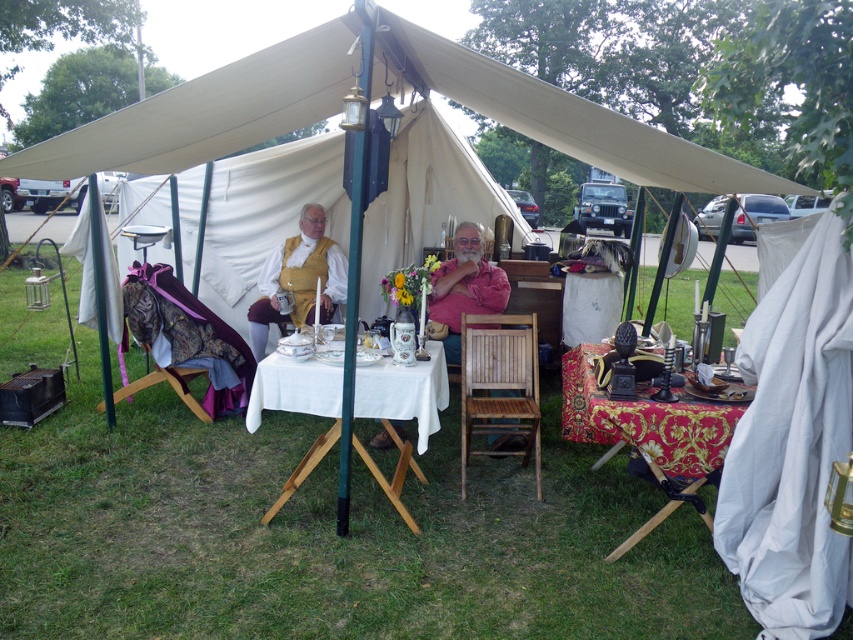
Is red damask tablecloth at lower right smaller than matte yellow vest at center?

Incorrect, red damask tablecloth at lower right is not smaller in size than matte yellow vest at center.

I want to click on red damask tablecloth at lower right, so click(645, 420).

You are a GUI agent. You are given a task and a screenshot of the screen. Output one action in this format:
    pyautogui.click(x=<x>, y=<y>)
    Task: Click on the red damask tablecloth at lower right
    Image resolution: width=853 pixels, height=640 pixels.
    Given the screenshot: What is the action you would take?
    pyautogui.click(x=645, y=420)

What do you see at coordinates (206, 112) in the screenshot?
I see `beige canvas canopy at upper center` at bounding box center [206, 112].

Is point (25, 156) behind point (292, 262)?

No, it is not.

You are a GUI agent. You are given a task and a screenshot of the screen. Output one action in this format:
    pyautogui.click(x=<x>, y=<y>)
    Task: Click on the beige canvas canopy at upper center
    The image size is (853, 640).
    Given the screenshot: What is the action you would take?
    pyautogui.click(x=206, y=112)

Can you confirm if white cloth-covered table at center is taller than red damask tablecloth at lower right?

Yes.

Is white cloth-covered table at center thinner than red damask tablecloth at lower right?

Incorrect, white cloth-covered table at center's width is not less than red damask tablecloth at lower right's.

Where is `white cloth-covered table at center`? white cloth-covered table at center is located at coordinates (401, 412).